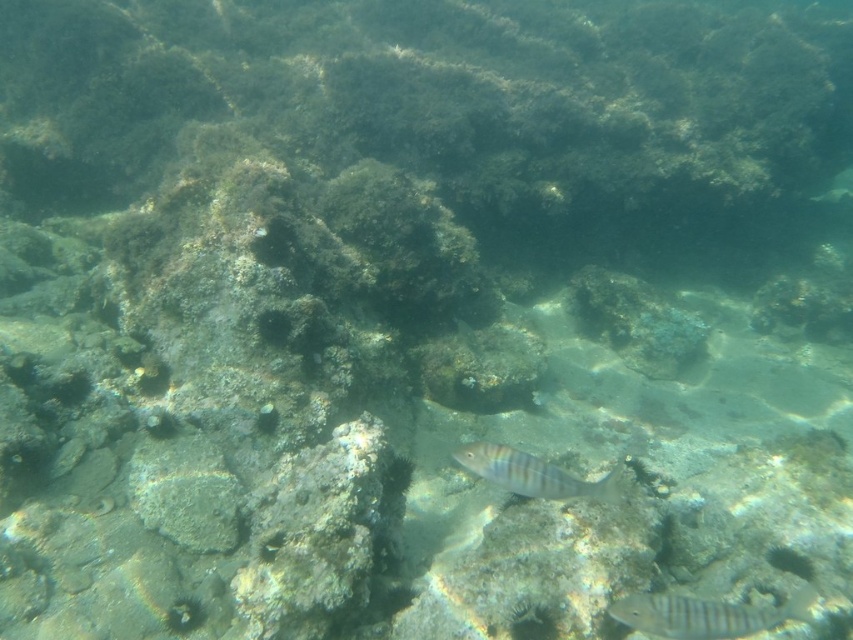
You are a marine biologist studying underwater life. You observe two fish in the scene. One is a striped silver fish at center. The other is a striped silver fish at center. Which fish is closer to the point with coordinates point (706,614)?

Both fish are at the same location since they are both described as striped silver fish at center.

You are a marine biologist diving in this underwater scene. You need to capture a closeup photo of the striped silver fish at center. Your camera has a maximum focus range of 1.5 meters. Can you take the photo without moving closer?

The striped silver fish at center and camera are 1.82 meters apart from each other, which exceeds the camera maximum focus range of 1.5 meters. Therefore, you cannot take the closeup photo without moving closer.

You are a marine biologist observing underwater. You have a net that can reach up to 15 inches. There are two fish in front of you, a striped silver fish at center and a shiny silver fish at center. Can you catch both with one throw?

The striped silver fish at center is 14.79 inches away from the shiny silver fish at center. Since the net can reach up to 15 inches, you can catch both with one throw as the distance between them is within the net range.